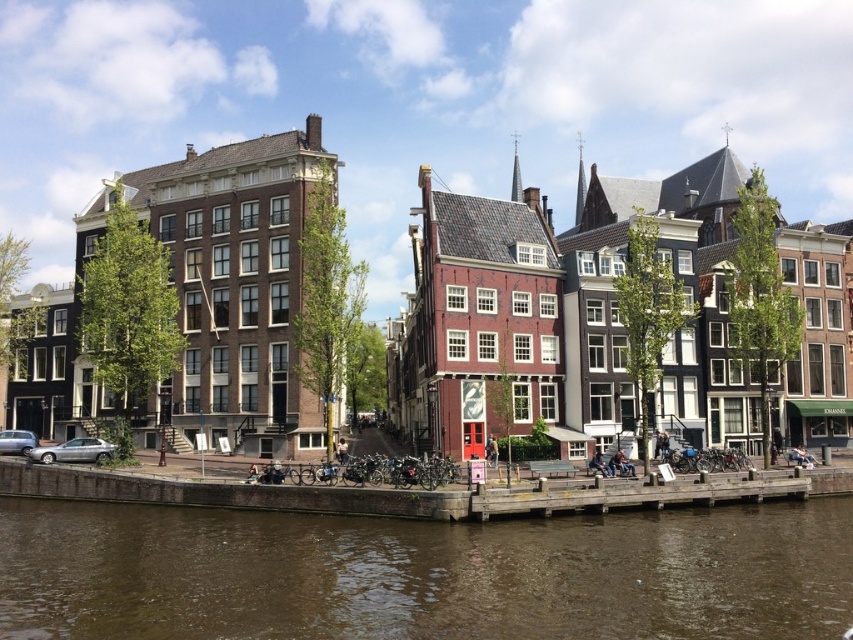
Based on the photo, is brown murky water at lower center bigger than wooden dock at lower center?

Correct, brown murky water at lower center is larger in size than wooden dock at lower center.

Identify the location of brown murky water at lower center. (424, 573).

Is point (109, 516) farther from viewer compared to point (556, 509)?

Yes, it is.

You are a GUI agent. You are given a task and a screenshot of the screen. Output one action in this format:
    pyautogui.click(x=<x>, y=<y>)
    Task: Click on the brown murky water at lower center
    Image resolution: width=853 pixels, height=640 pixels.
    Given the screenshot: What is the action you would take?
    pyautogui.click(x=424, y=573)